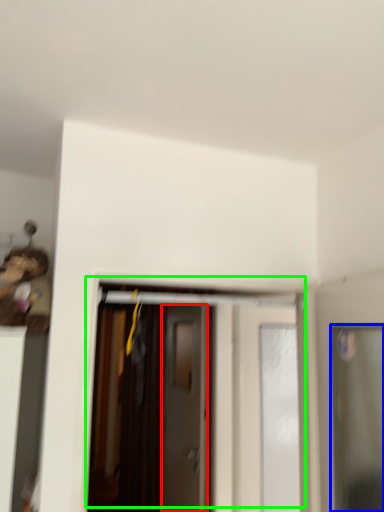
Question: Which is nearer to the door (highlighted by a red box)? door (highlighted by a blue box) or door (highlighted by a green box).

Choices:
 (A) door
 (B) door

Answer: (B)